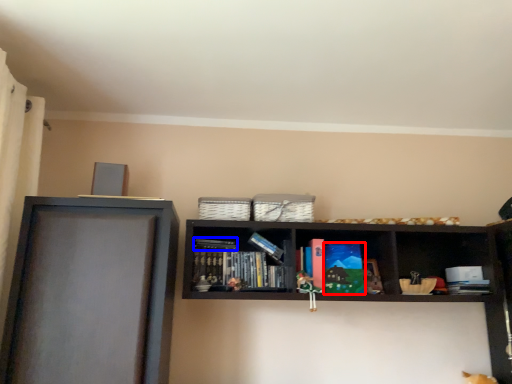
Question: Which object is further to the camera taking this photo, paperback book (highlighted by a red box) or book (highlighted by a blue box)?

Choices:
 (A) paperback book
 (B) book

Answer: (B)